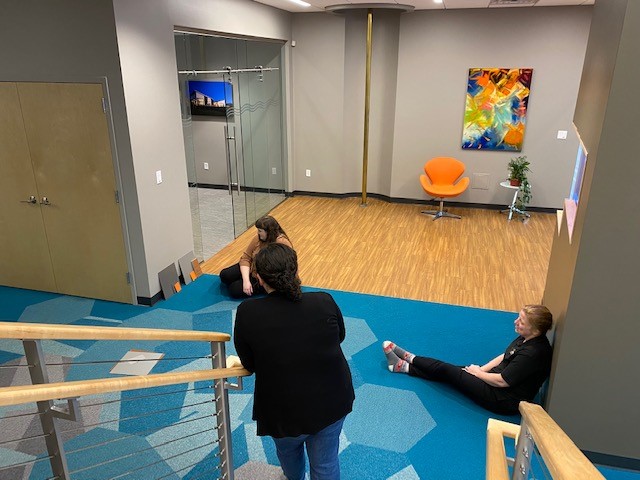
The width and height of the screenshot is (640, 480). In order to click on art on wall in this screenshot , I will do `click(486, 118)`.